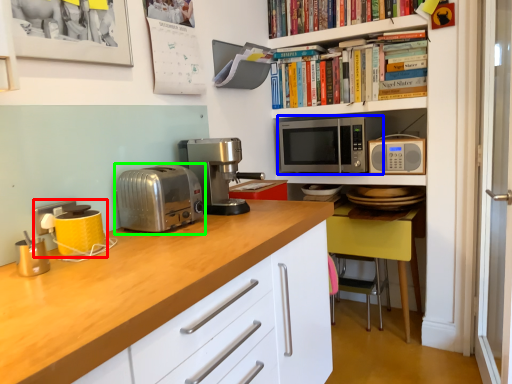
Question: Based on their relative distances, which object is farther from coffee machine (highlighted by a red box)? Choose from microwave oven (highlighted by a blue box) and toaster (highlighted by a green box).

Choices:
 (A) microwave oven
 (B) toaster

Answer: (A)